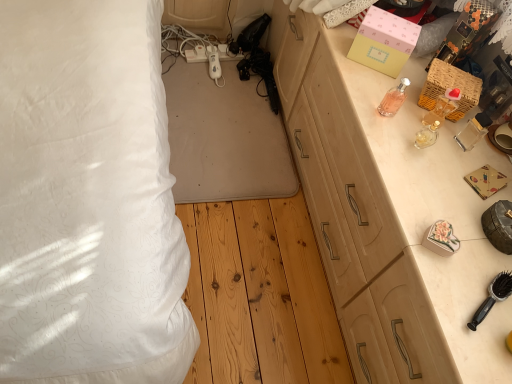
In order to click on vacant space in front of pink matte box at upper right, placed as the first box when sorted from left to right in this screenshot , I will do `click(369, 88)`.